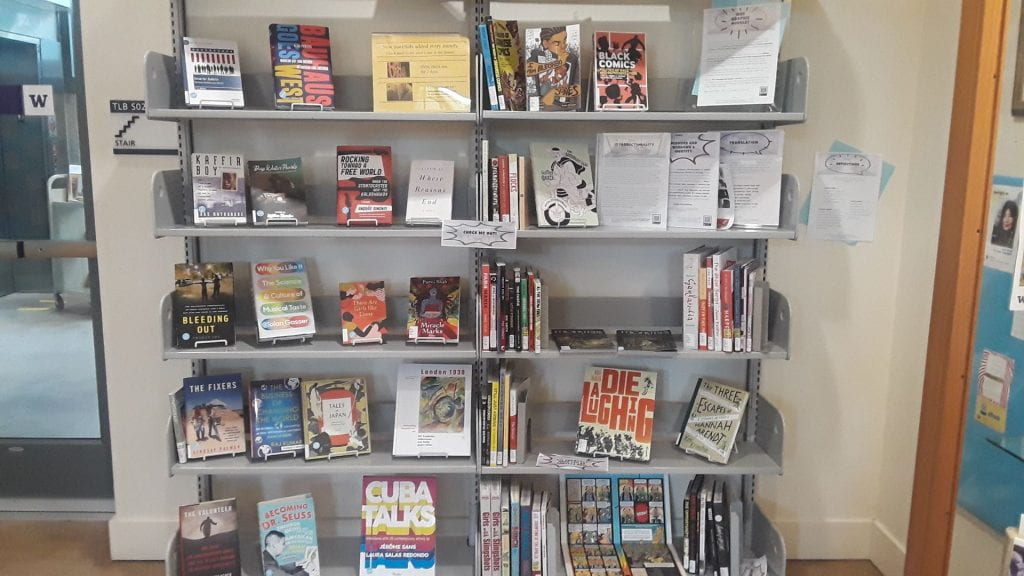
In order to click on gray push bar to open door in this screenshot , I will do `click(41, 250)`.